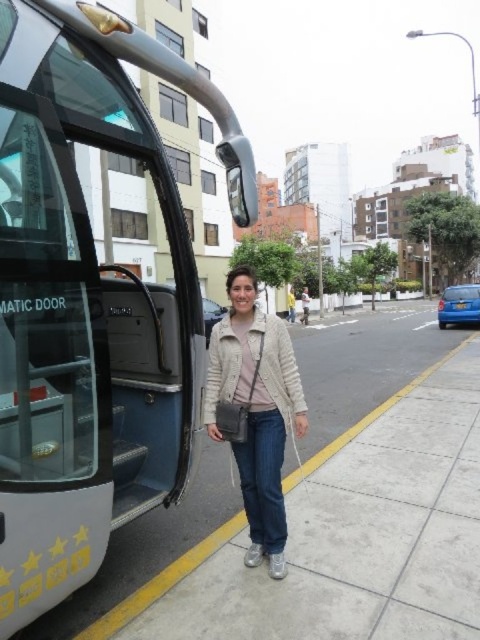
You are a city planner analyzing traffic flow. You need to determine if the metallic silver tour bus at center can fit through a narrow alley that is only 3 meters wide. The light beige textured jacket at center is part of the bus driver. Can you estimate if the bus will fit based on the size comparison?

The metallic silver tour bus at center has a larger size compared to the light beige textured jacket at center. Since the jacket is part of the driver, the bus is significantly larger. However, without knowing the exact dimensions of the bus, it is impossible to accurately determine if it can fit through a 3 meter wide alley. Additional measurements are needed.

You are a delivery person with a box that is 2 meters long. You are standing in front of the metallic silver tour bus at center. Can you fit the box horizontally between the bus and the nearest wall behind it?

The metallic silver tour bus at center is 1.88 meters away from camera, so the box that is 2 meters long cannot fit horizontally between the bus and the nearest wall behind it because the distance is shorter than the box length.

You are standing at point (285, 532) and want to walk to the bus door. Is point (192, 264) behind you or in front of you?

Point (192, 264) is behind point (285, 532), so it is behind you.